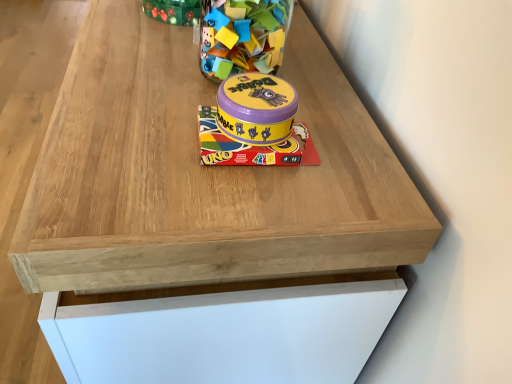
Question: Can you confirm if matte purple tin at center, the 2th toy in the back-to-front sequence, is thinner than translucent plastic container at upper center, the second toy in the bottom-to-top sequence?

Choices:
 (A) no
 (B) yes

Answer: (A)

Question: Is translucent plastic container at upper center, the first toy from the back, surrounded by matte purple tin at center, the 2th toy in the back-to-front sequence?

Choices:
 (A) no
 (B) yes

Answer: (A)

Question: Are matte purple tin at center, placed as the 1th toy when sorted from bottom to top, and translucent plastic container at upper center, the 2th toy from the front, located far from each other?

Choices:
 (A) yes
 (B) no

Answer: (B)

Question: Can you confirm if matte purple tin at center, placed as the 1th toy when sorted from bottom to top, is bigger than translucent plastic container at upper center, the second toy in the bottom-to-top sequence?

Choices:
 (A) yes
 (B) no

Answer: (B)

Question: Considering the relative positions of matte purple tin at center, the second toy in the top-to-bottom sequence, and translucent plastic container at upper center, the second toy in the bottom-to-top sequence, in the image provided, is matte purple tin at center, the second toy in the top-to-bottom sequence, behind translucent plastic container at upper center, the second toy in the bottom-to-top sequence,?

Choices:
 (A) no
 (B) yes

Answer: (A)

Question: From a real-world perspective, is matte purple tin at center, the 2th toy in the back-to-front sequence, on translucent plastic container at upper center, the first toy from the back?

Choices:
 (A) no
 (B) yes

Answer: (A)

Question: Is translucent plastic container at upper center, the first toy from the back, at the right side of matte purple tin at center, the second toy in the top-to-bottom sequence?

Choices:
 (A) no
 (B) yes

Answer: (B)

Question: From a real-world perspective, is translucent plastic container at upper center, which appears as the first toy when viewed from the top, located beneath matte purple tin at center, which appears as the 1th toy when viewed from the front?

Choices:
 (A) no
 (B) yes

Answer: (A)

Question: Is matte purple tin at center, the second toy in the top-to-bottom sequence, located within translucent plastic container at upper center, the second toy in the bottom-to-top sequence?

Choices:
 (A) no
 (B) yes

Answer: (A)

Question: Is translucent plastic container at upper center, the 2th toy from the front, thinner than matte purple tin at center, the 2th toy in the back-to-front sequence?

Choices:
 (A) no
 (B) yes

Answer: (B)

Question: Can you confirm if translucent plastic container at upper center, the first toy from the back, is smaller than matte purple tin at center, the 2th toy in the back-to-front sequence?

Choices:
 (A) yes
 (B) no

Answer: (B)

Question: Is the depth of translucent plastic container at upper center, the second toy in the bottom-to-top sequence, less than that of matte purple tin at center, placed as the 1th toy when sorted from bottom to top?

Choices:
 (A) yes
 (B) no

Answer: (B)

Question: Is matte purple tin at center, the second toy in the top-to-bottom sequence, inside the boundaries of translucent plastic container at upper center, the 2th toy from the front, or outside?

Choices:
 (A) inside
 (B) outside

Answer: (B)